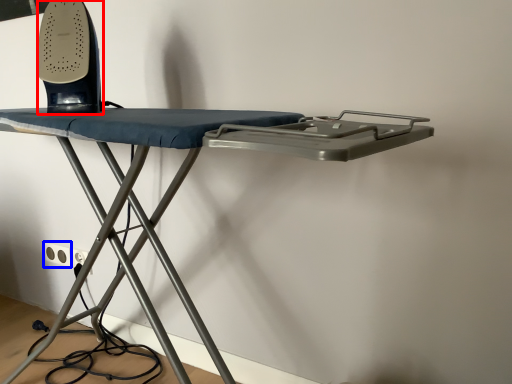
Question: Which object appears closest to the camera in this image, equipment (highlighted by a red box) or electric outlet (highlighted by a blue box)?

Choices:
 (A) equipment
 (B) electric outlet

Answer: (A)